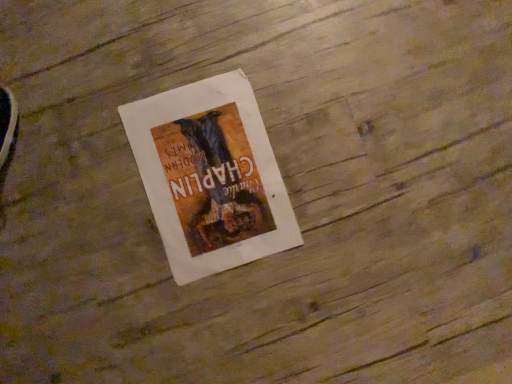
Where is `free spot above white paper poster at center (from a real-world perspective)`? The image size is (512, 384). free spot above white paper poster at center (from a real-world perspective) is located at coordinates (202, 167).